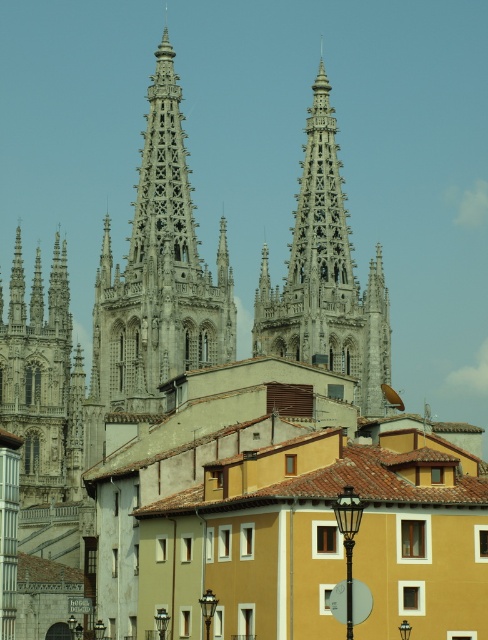
You are a drone operator tasked with capturing aerial footage of the white stone spire at center and the gray stone tower at left. The minimum distance required between the drone and any structure is 20 meters for safety. Can the drone safely fly between the two structures to capture both in a single shot?

The white stone spire at center and the gray stone tower at left are 19.71 meters apart. Since the required safety distance is 20 meters, the drone cannot safely fly between them as the gap is narrower than the required distance.

You are standing in front of the Gothic cathedral and want to place a flag at the point marked as point (139, 400). If your flagpole is 120 meters long, will it reach that point?

The point (139, 400) is 116.93 meters away from the viewer, so yes, the flagpole can reach it since it is shorter than the flagpole length.

You are an architect analyzing the image of the Gothic cathedral and modern buildings. You notice the gray stone spire at center and the white stone spire at center. Which spire would appear larger to someone standing at the base of the cathedral?

The gray stone spire at center appears larger because it is closer to the viewer than the white stone spire at center.